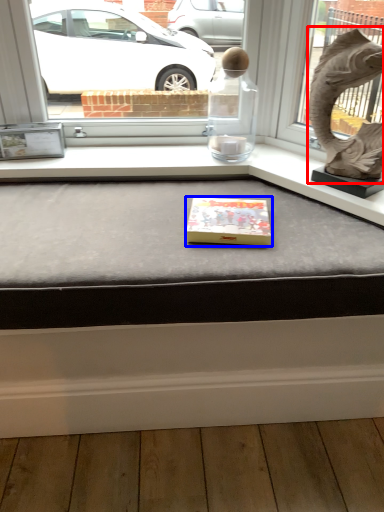
Question: Among these objects, which one is nearest to the camera, animal sculpture (highlighted by a red box) or box (highlighted by a blue box)?

Choices:
 (A) animal sculpture
 (B) box

Answer: (A)